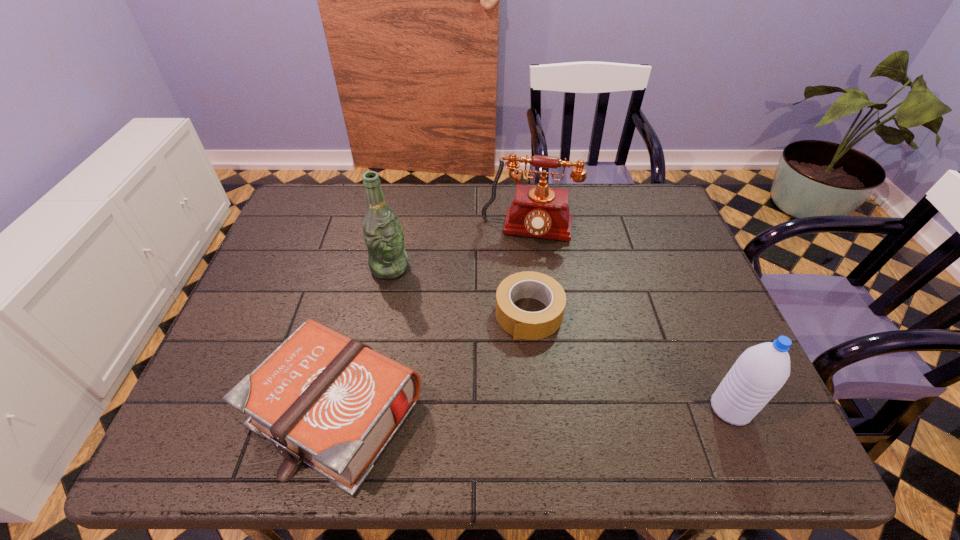
The width and height of the screenshot is (960, 540). What are the coordinates of `object positioned at the left edge` in the screenshot? It's located at (323, 399).

Where is `object at the right edge`? object at the right edge is located at coordinates (759, 373).

You are a GUI agent. You are given a task and a screenshot of the screen. Output one action in this format:
    pyautogui.click(x=<x>, y=<y>)
    Task: Click on the object that is at the near left corner
    This screenshot has width=960, height=540.
    Given the screenshot: What is the action you would take?
    pyautogui.click(x=323, y=399)

At what (x,y) coordinates should I click in order to perform the action: click on object positioned at the near right corner. Please return your answer as a coordinate pair (x, y). The height and width of the screenshot is (540, 960). Looking at the image, I should click on (759, 373).

In the image, there is a desktop. Where is `vacant space at the far edge`? This screenshot has width=960, height=540. vacant space at the far edge is located at coordinates (590, 209).

You are a GUI agent. You are given a task and a screenshot of the screen. Output one action in this format:
    pyautogui.click(x=<x>, y=<y>)
    Task: Click on the free space at the near edge of the desktop
    
    Given the screenshot: What is the action you would take?
    [572, 381]

The height and width of the screenshot is (540, 960). I want to click on free point at the left edge, so click(305, 248).

What are the coordinates of `vacant space at the right edge` in the screenshot? It's located at (697, 350).

Image resolution: width=960 pixels, height=540 pixels. In order to click on free space at the far left corner in this screenshot , I will do `click(310, 183)`.

Where is `vacant region at the near left corner of the desktop`? Image resolution: width=960 pixels, height=540 pixels. vacant region at the near left corner of the desktop is located at coordinates (207, 403).